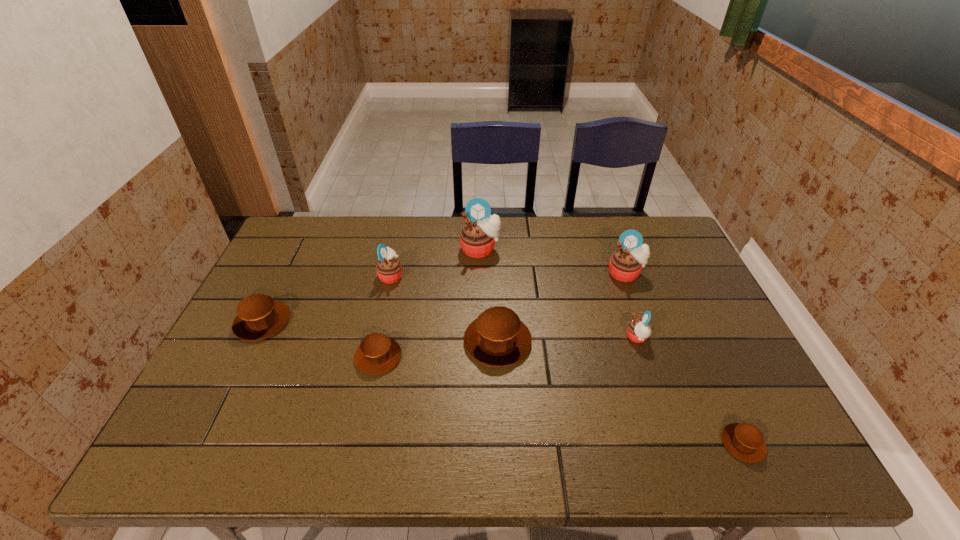
At what (x,y) coordinates should I click in order to perform the action: click on free space between the tallest muffin and the seventh shortest muffin. Please return your answer as a coordinate pair (x, y). This screenshot has height=540, width=960. Looking at the image, I should click on (553, 261).

This screenshot has height=540, width=960. I want to click on free space between the third biggest pink muffin and the leftmost object, so click(x=326, y=299).

I want to click on vacant space that is in between the nearest pink muffin and the second tallest object, so click(631, 306).

This screenshot has height=540, width=960. Identify the location of the closest object to the second shortest muffin. (497, 338).

Choose which object is the sixth nearest neighbor to the shortest muffin. Please provide its 2D coordinates. Your answer should be formatted as a tuple, i.e. [(x, y)], where the tuple contains the x and y coordinates of a point satisfying the conditions above.

[(389, 269)]

Locate an element on the screen. The height and width of the screenshot is (540, 960). the closest muffin to the third biggest brown muffin is located at coordinates (497, 338).

Where is `the sixth closest muffin to the seventh shortest muffin`? The height and width of the screenshot is (540, 960). the sixth closest muffin to the seventh shortest muffin is located at coordinates (377, 353).

Locate which pink muffin is the second closest to the seventh shortest muffin. Please provide its 2D coordinates. Your answer should be formatted as a tuple, i.e. [(x, y)], where the tuple contains the x and y coordinates of a point satisfying the conditions above.

[(481, 230)]

You are a GUI agent. You are given a task and a screenshot of the screen. Output one action in this format:
    pyautogui.click(x=<x>, y=<y>)
    Task: Click on the pink muffin that is the second closest one to the second biggest pink muffin
    
    Given the screenshot: What is the action you would take?
    pos(481,230)

Locate which brown muffin ranks in proximity to the farthest pink muffin. Please provide its 2D coordinates. Your answer should be formatted as a tuple, i.e. [(x, y)], where the tuple contains the x and y coordinates of a point satisfying the conditions above.

[(497, 338)]